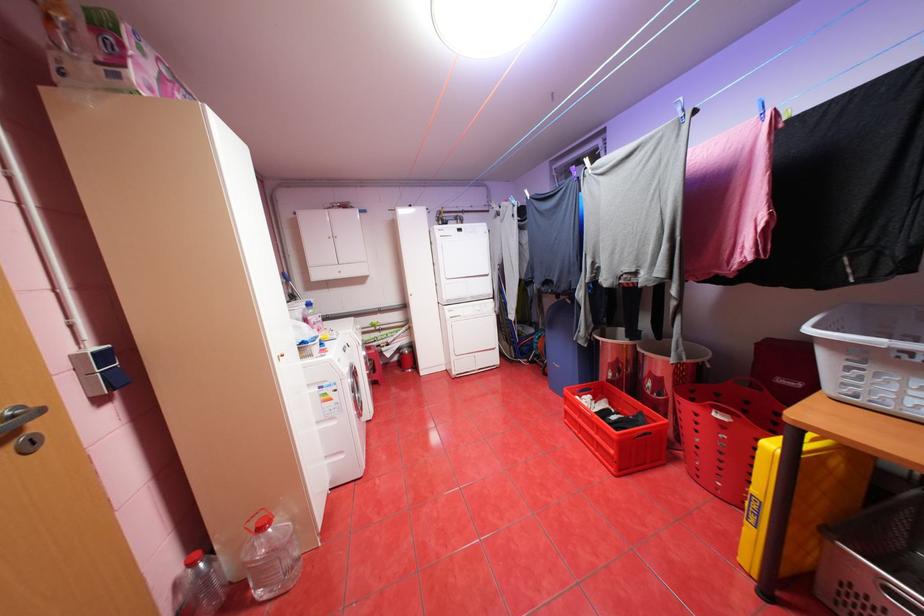
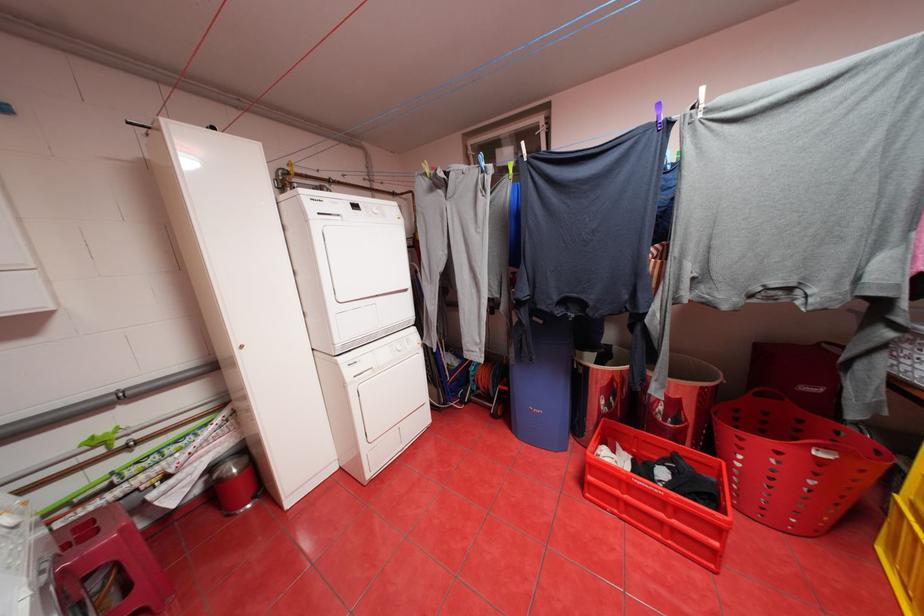
The point at (618, 403) is marked in the first image. Where is the corresponding point in the second image?

(631, 448)